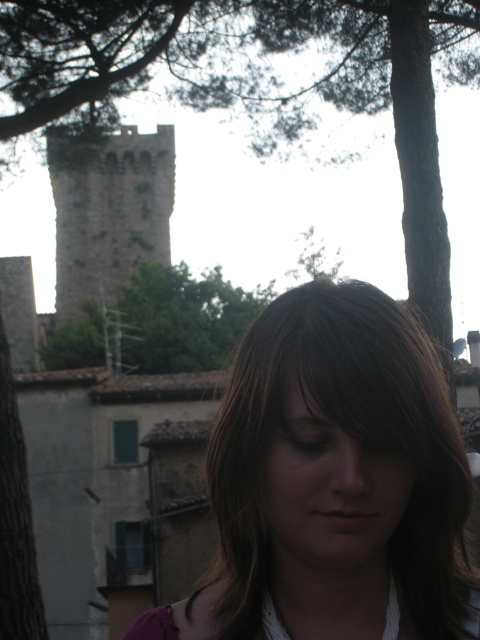
You are standing in front of the stone tower at upper left and want to take a photo that includes both the tower and the pink garment underneath the white top. Since the tower is quite far away, will you be able to capture both in the same frame?

The stone tower at upper left is 380.44 feet from camera, so it is too far to capture both the tower and the pink garment underneath the white top in the same frame.

You are a photographer trying to capture a portrait of the person with brown hair at center. There is a green leafy tree at upper center in the background that might distract from the subject. Based on the scene, can you determine if the tree will appear in the background or in front of the person in the photo?

The brown hair at center is closer to the viewer than the green leafy tree at upper center, so the tree will appear in the background behind the person, not in front.